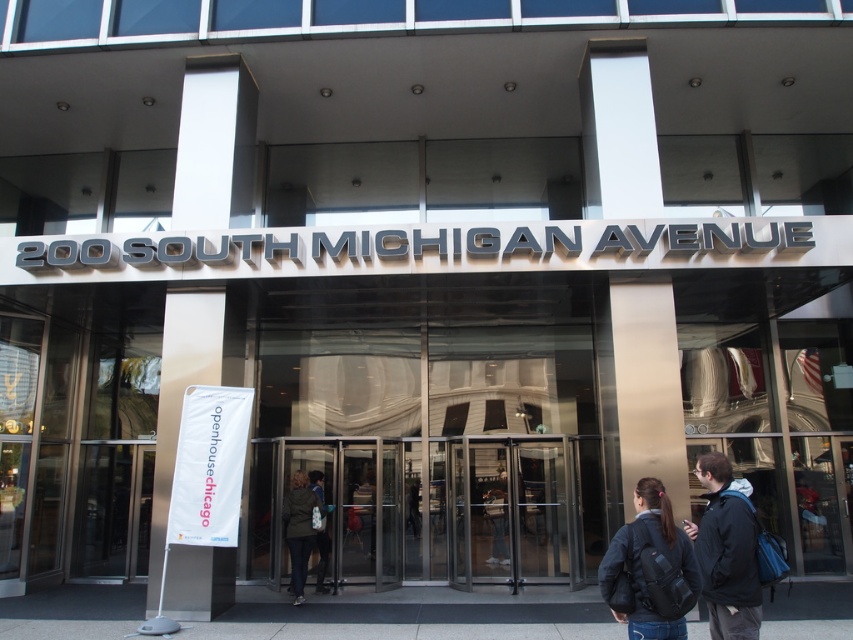
You are a delivery person holding a package that requires a 3.5 meter clearance to pass through the entrance. You see the black matte jacket at lower right. Can you determine if the clearance is sufficient?

The black matte jacket at lower right is 3.69 meters from the camera, which means the clearance is sufficient as it exceeds the required 3.5 meters.

You are a delivery person carrying a package that is 1.2 meters wide. You need to enter the building through the revolving doors. Given that the black backpack at center and the green fabric coat at center are placed near the entrance, can you determine if your package will fit through the revolving doors?

The black backpack at center is wider than the green fabric coat at center. Since the package is 1.2 meters wide, and the backpack is wider than the coat, but there is no specific measurement provided about the revolving doors width, it is impossible to determine if the package will fit through the revolving doors based on the given information.

You are a delivery person carrying a package and need to enter the building through the revolving doors. You see a black backpack at center and a black matte jacket at lower right. Which object is shorter and might be easier to avoid while moving through the doors?

The black backpack at center is not as tall as the black matte jacket at lower right, so the black backpack at center is shorter and easier to avoid while moving through the doors.